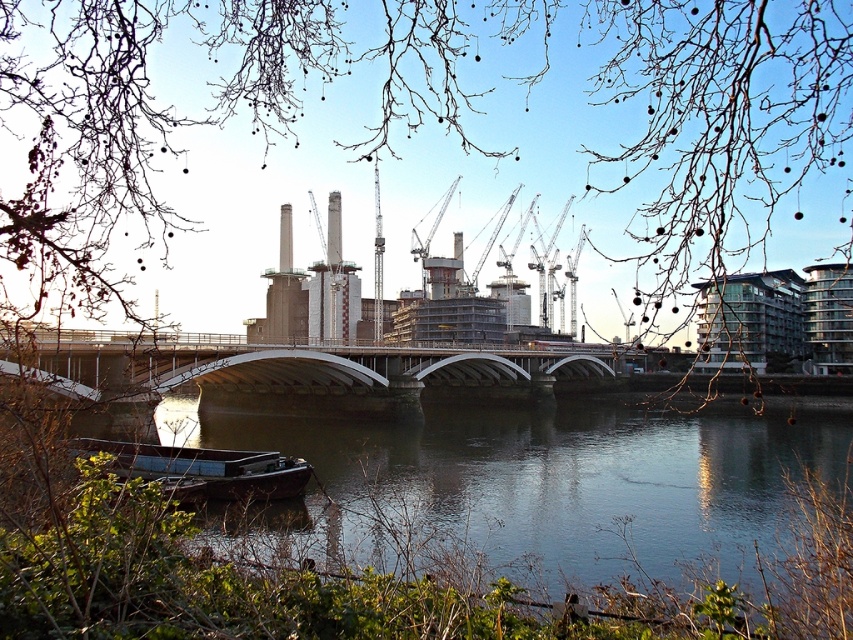
Question: Which point appears closest to the camera in this image?

Choices:
 (A) (335, 444)
 (B) (253, 346)

Answer: (B)

Question: Does white concrete bridge at center have a smaller size compared to wooden boat at lower left?

Choices:
 (A) yes
 (B) no

Answer: (B)

Question: Which object is the farthest from the wooden boat at lower left?

Choices:
 (A) clear water at lower left
 (B) white concrete bridge at center

Answer: (A)

Question: Among these points, which one is farthest from the camera?

Choices:
 (A) (207, 449)
 (B) (172, 378)

Answer: (A)

Question: Does white concrete bridge at center appear under wooden boat at lower left?

Choices:
 (A) yes
 (B) no

Answer: (B)

Question: Can you confirm if clear water at lower left is smaller than wooden boat at lower left?

Choices:
 (A) no
 (B) yes

Answer: (A)